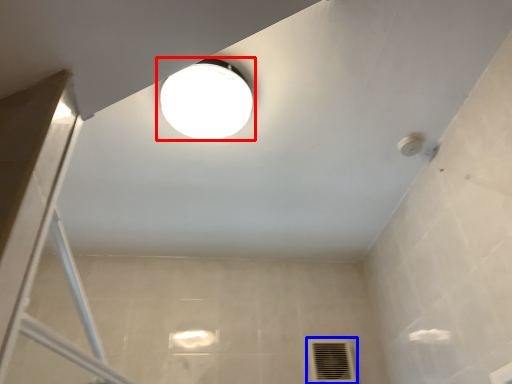
Question: Which of the following is the closest to the observer, lamp (highlighted by a red box) or air conditioning (highlighted by a blue box)?

Choices:
 (A) lamp
 (B) air conditioning

Answer: (A)